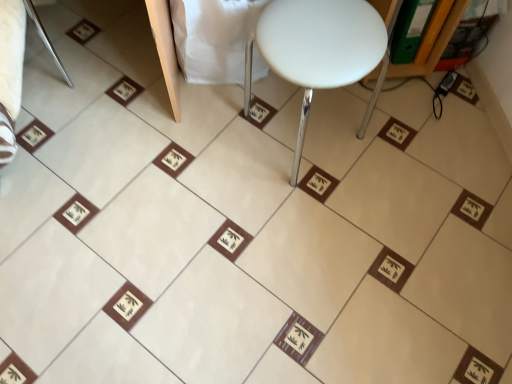
The image size is (512, 384). I want to click on free space to the left of white glossy stool at center, so click(200, 150).